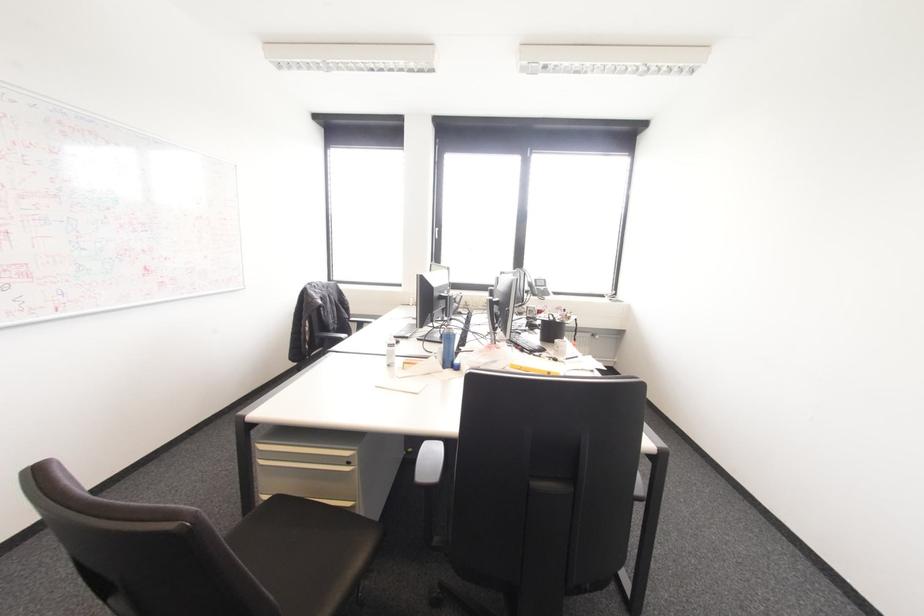
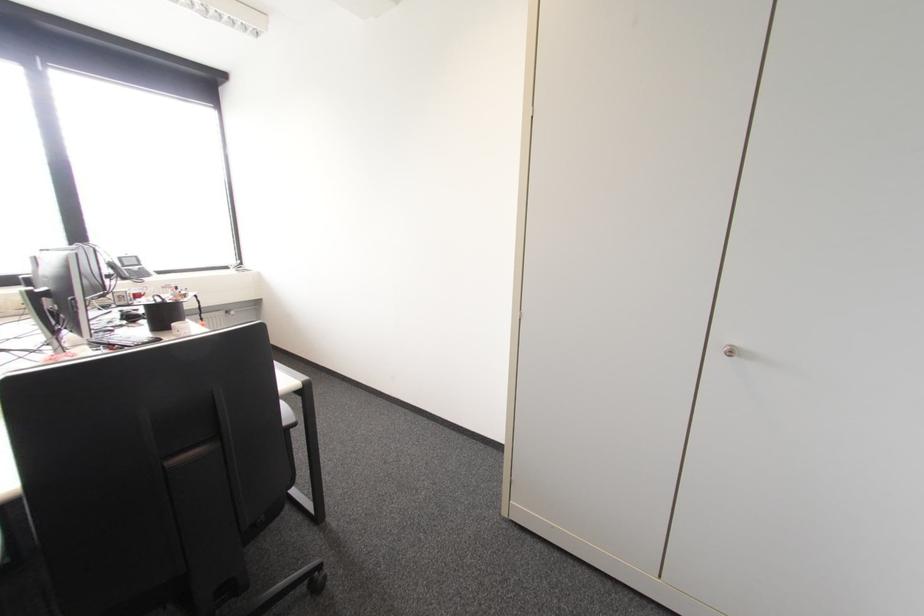
In the second image, find the point that corresponds to (x=533, y=294) in the first image.

(123, 278)